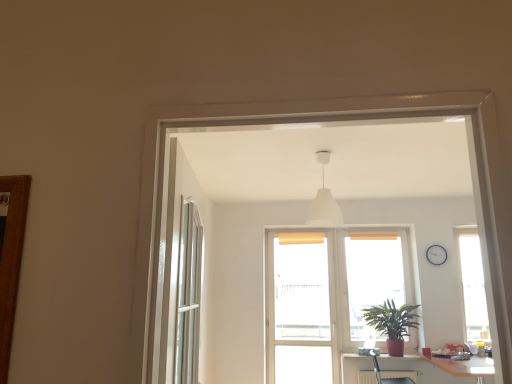
Question: From a real-world perspective, is translucent plastic screen door at center below translucent fabric screen at center?

Choices:
 (A) yes
 (B) no

Answer: (A)

Question: Could you tell me if translucent plastic screen door at center is facing translucent fabric screen at center?

Choices:
 (A) no
 (B) yes

Answer: (A)

Question: From the image's perspective, is translucent plastic screen door at center below translucent fabric screen at center?

Choices:
 (A) yes
 (B) no

Answer: (A)

Question: Considering the relative sizes of translucent plastic screen door at center and translucent fabric screen at center in the image provided, is translucent plastic screen door at center wider than translucent fabric screen at center?

Choices:
 (A) yes
 (B) no

Answer: (A)

Question: Considering the relative positions of translucent plastic screen door at center and translucent fabric screen at center in the image provided, is translucent plastic screen door at center to the left of translucent fabric screen at center from the viewer's perspective?

Choices:
 (A) no
 (B) yes

Answer: (B)

Question: Is metallic silver armchair at lower right wider or thinner than green matte plant at lower right?

Choices:
 (A) thin
 (B) wide

Answer: (B)

Question: Is metallic silver armchair at lower right situated inside green matte plant at lower right or outside?

Choices:
 (A) outside
 (B) inside

Answer: (A)

Question: Is metallic silver armchair at lower right bigger or smaller than green matte plant at lower right?

Choices:
 (A) big
 (B) small

Answer: (B)

Question: From their relative heights in the image, would you say metallic silver armchair at lower right is taller or shorter than green matte plant at lower right?

Choices:
 (A) short
 (B) tall

Answer: (A)

Question: Considering the positions of white plastic clock at upper right and green matte plant at lower right in the image, is white plastic clock at upper right bigger or smaller than green matte plant at lower right?

Choices:
 (A) small
 (B) big

Answer: (A)

Question: Which is correct: white plastic clock at upper right is inside green matte plant at lower right, or outside of it?

Choices:
 (A) outside
 (B) inside

Answer: (A)

Question: From the image's perspective, is white plastic clock at upper right above or below green matte plant at lower right?

Choices:
 (A) below
 (B) above

Answer: (B)

Question: Considering the relative positions of white plastic clock at upper right and green matte plant at lower right in the image provided, is white plastic clock at upper right to the left or to the right of green matte plant at lower right?

Choices:
 (A) right
 (B) left

Answer: (A)

Question: In terms of width, does white glossy table at lower right look wider or thinner when compared to metallic silver armchair at lower right?

Choices:
 (A) thin
 (B) wide

Answer: (B)

Question: In the image, is white glossy table at lower right on the left side or the right side of metallic silver armchair at lower right?

Choices:
 (A) left
 (B) right

Answer: (B)